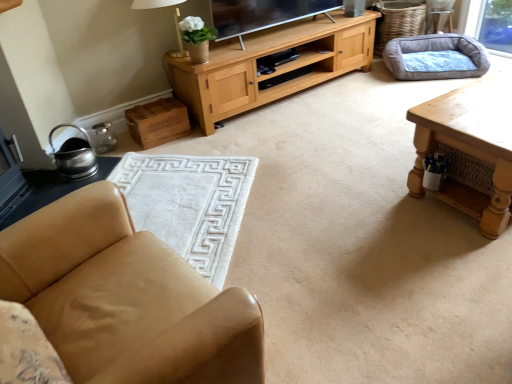
Locate an element on the screen. vacant area to the right of white soft rug at lower left is located at coordinates (334, 214).